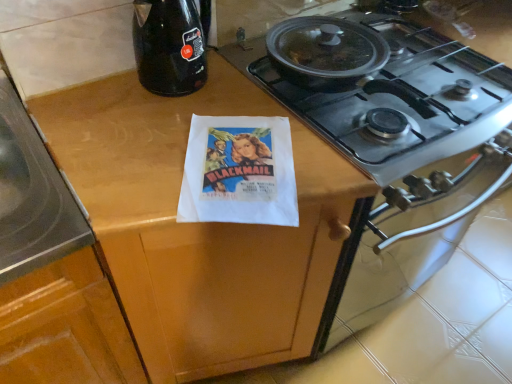
Question: Should I look upward or downward to see wooden at center?

Choices:
 (A) down
 (B) up

Answer: (A)

Question: Are wooden at center and white paper flyer at center located far from each other?

Choices:
 (A) yes
 (B) no

Answer: (B)

Question: Considering the relative sizes of wooden at center and white paper flyer at center in the image provided, is wooden at center smaller than white paper flyer at center?

Choices:
 (A) no
 (B) yes

Answer: (A)

Question: Does wooden at center have a greater height compared to white paper flyer at center?

Choices:
 (A) no
 (B) yes

Answer: (B)

Question: From the image's perspective, is wooden at center on top of white paper flyer at center?

Choices:
 (A) no
 (B) yes

Answer: (A)

Question: From a real-world perspective, is wooden at center below white paper flyer at center?

Choices:
 (A) yes
 (B) no

Answer: (A)

Question: Is wooden at center bigger than white paper flyer at center?

Choices:
 (A) yes
 (B) no

Answer: (A)

Question: Considering the relative sizes of wooden at center and black glass bottle at upper left in the image provided, is wooden at center thinner than black glass bottle at upper left?

Choices:
 (A) no
 (B) yes

Answer: (A)

Question: Is wooden at center shorter than black glass bottle at upper left?

Choices:
 (A) no
 (B) yes

Answer: (A)

Question: Is wooden at center turned away from black glass bottle at upper left?

Choices:
 (A) no
 (B) yes

Answer: (A)

Question: Can you confirm if wooden at center is positioned to the left of black glass bottle at upper left?

Choices:
 (A) no
 (B) yes

Answer: (A)

Question: Can you see wooden at center touching black glass bottle at upper left?

Choices:
 (A) yes
 (B) no

Answer: (B)

Question: Does wooden at center lie in front of black glass bottle at upper left?

Choices:
 (A) no
 (B) yes

Answer: (B)

Question: From the image's perspective, is black glass bottle at upper left beneath wooden at center?

Choices:
 (A) no
 (B) yes

Answer: (A)